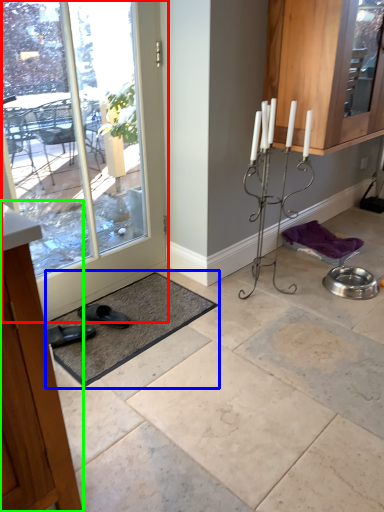
Question: Based on their relative distances, which object is nearer to door (highlighted by a red box)? Choose from bath mat (highlighted by a blue box) and cabinetry (highlighted by a green box).

Choices:
 (A) bath mat
 (B) cabinetry

Answer: (A)